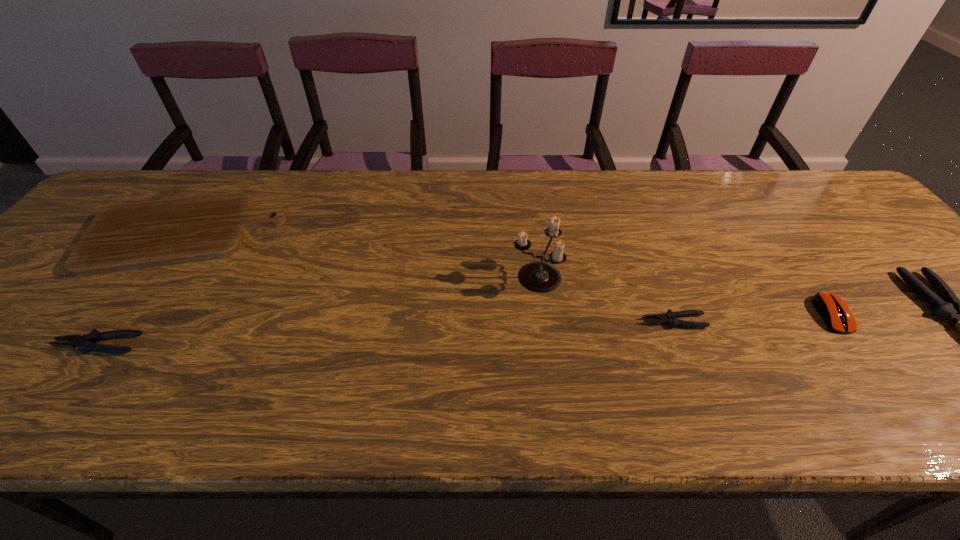
You are a GUI agent. You are given a task and a screenshot of the screen. Output one action in this format:
    pyautogui.click(x=<x>, y=<y>)
    Task: Click on the object that is the third nearest to the tallest object
    This screenshot has width=960, height=540.
    Given the screenshot: What is the action you would take?
    pyautogui.click(x=129, y=236)

Where is `object that ranks as the fifth closest to the shortest object`? This screenshot has width=960, height=540. object that ranks as the fifth closest to the shortest object is located at coordinates (85, 343).

Identify which pliers is the closest to the rightmost pliers. Please provide its 2D coordinates. Your answer should be formatted as a tuple, i.e. [(x, y)], where the tuple contains the x and y coordinates of a point satisfying the conditions above.

[(670, 318)]

Identify the location of pliers that is the second closest to the computer mouse. (670, 318).

This screenshot has height=540, width=960. Identify the location of vacant region that satisfies the following two spatial constraints: 1. on the front side of the chopping board; 2. at the gripping part of the second tallest pliers. (105, 345).